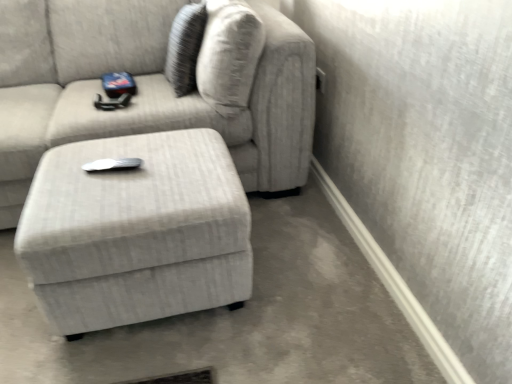
Question: Relative to textured fabric couch at center, is light gray fabric ottoman at center in front or behind?

Choices:
 (A) front
 (B) behind

Answer: (A)

Question: From a real-world perspective, is light gray fabric ottoman at center physically located above or below textured fabric couch at center?

Choices:
 (A) above
 (B) below

Answer: (B)

Question: Considering the positions of light gray fabric ottoman at center and textured fabric couch at center in the image, is light gray fabric ottoman at center wider or thinner than textured fabric couch at center?

Choices:
 (A) wide
 (B) thin

Answer: (B)

Question: Is textured fabric couch at center spatially inside light gray fabric ottoman at center, or outside of it?

Choices:
 (A) inside
 (B) outside

Answer: (B)

Question: Is textured fabric couch at center wider or thinner than light gray fabric ottoman at center?

Choices:
 (A) thin
 (B) wide

Answer: (B)

Question: From the image's perspective, is textured fabric couch at center above or below light gray fabric ottoman at center?

Choices:
 (A) below
 (B) above

Answer: (B)

Question: In the image, is textured fabric couch at center on the left side or the right side of light gray fabric ottoman at center?

Choices:
 (A) left
 (B) right

Answer: (A)